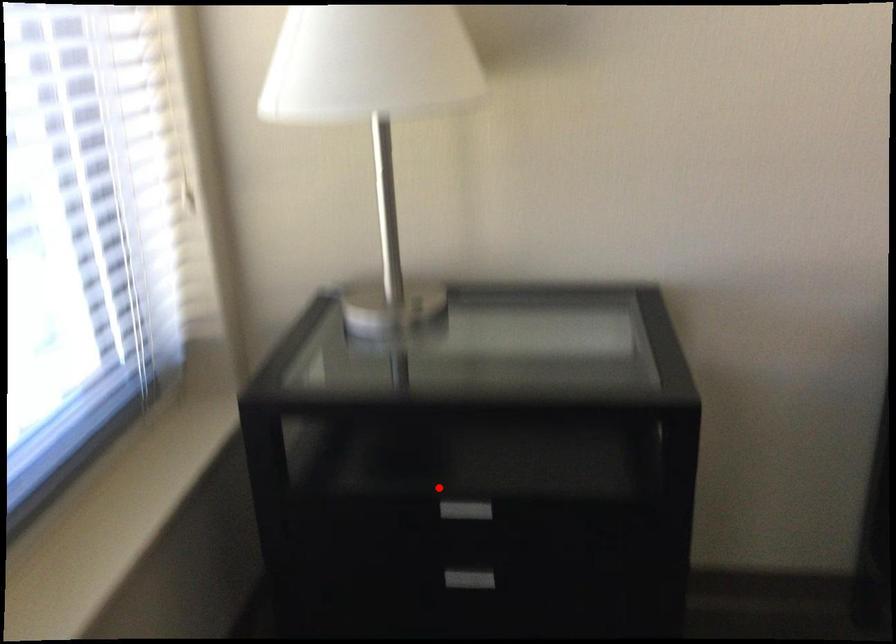
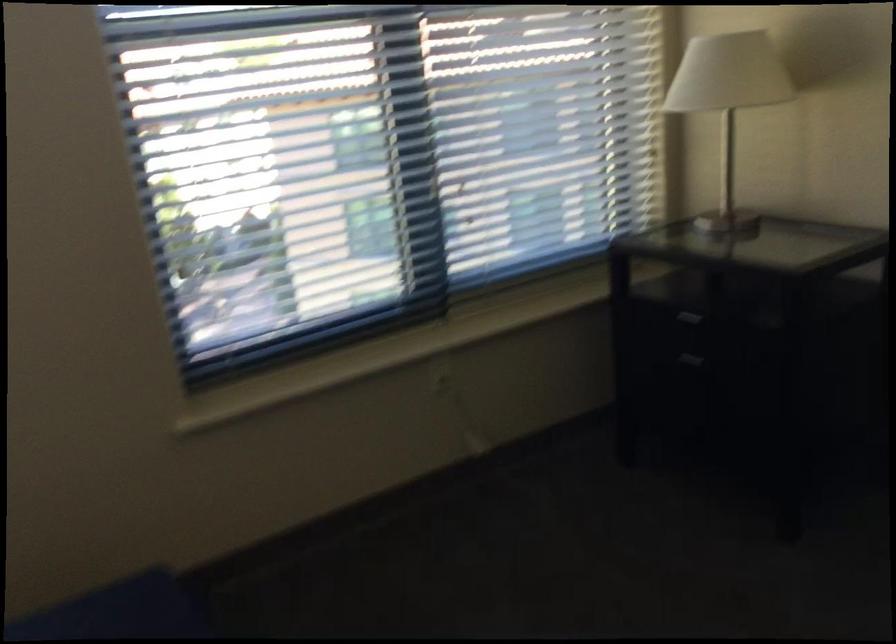
In the second image, find the point that corresponds to the highlighted location in the first image.

(682, 330)